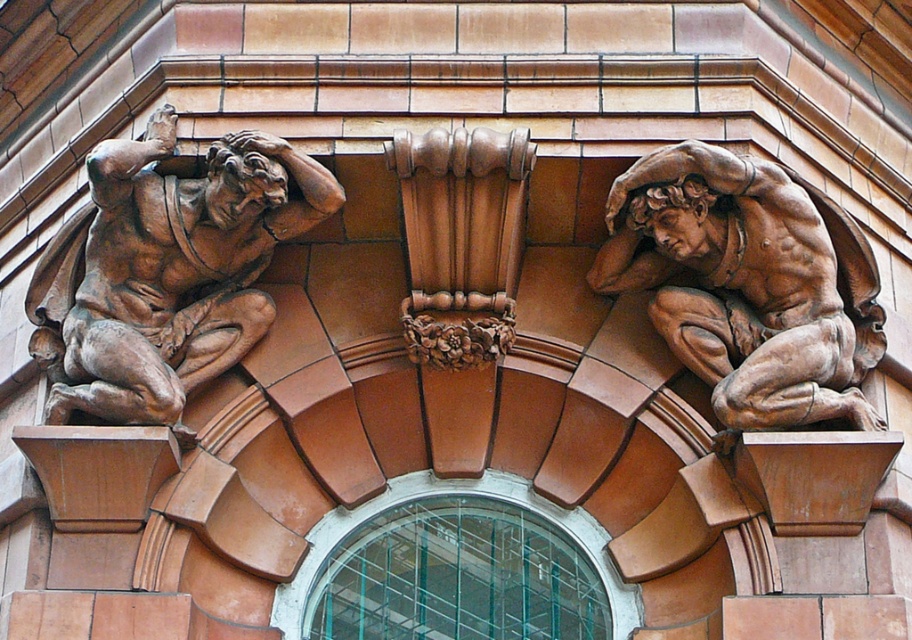
Question: Can you confirm if brown polished stone sculpture at upper left is positioned to the right of brown polished stone muscular figure at upper right?

Choices:
 (A) yes
 (B) no

Answer: (B)

Question: Which of the following is the closest to the observer?

Choices:
 (A) brown polished stone muscular figure at upper right
 (B) brown polished stone sculpture at upper left

Answer: (A)

Question: Does brown polished stone sculpture at upper left have a smaller size compared to brown polished stone muscular figure at upper right?

Choices:
 (A) no
 (B) yes

Answer: (A)

Question: Is brown polished stone sculpture at upper left to the left of brown polished stone muscular figure at upper right from the viewer's perspective?

Choices:
 (A) yes
 (B) no

Answer: (A)